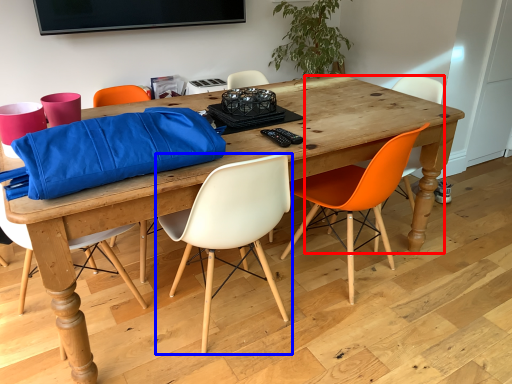
Question: Which object appears farthest to the camera in this image, chair (highlighted by a red box) or chair (highlighted by a blue box)?

Choices:
 (A) chair
 (B) chair

Answer: (A)